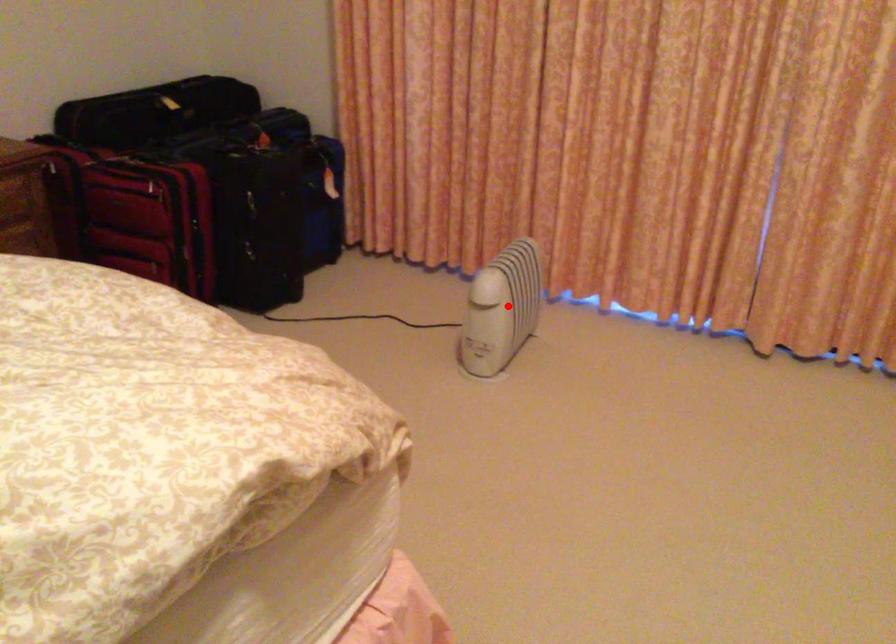
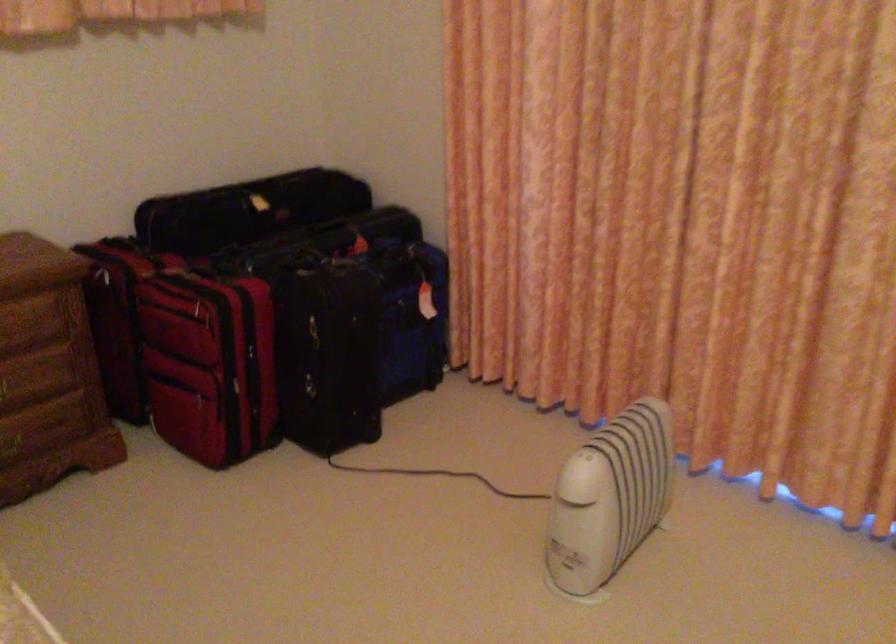
Question: I am providing you with two images of the same scene from different viewpoints. Image1 has a red point marked. In image2, the corresponding 3D location appears at what relative position? Reply with the corresponding letter.

Choices:
 (A) Closer
 (B) Farther

Answer: (A)